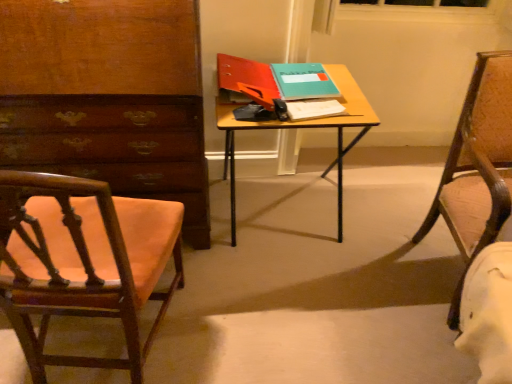
Where is `vacant area that lies to the right of teal matte book at center, the 2th book from the left`? The image size is (512, 384). vacant area that lies to the right of teal matte book at center, the 2th book from the left is located at coordinates (344, 90).